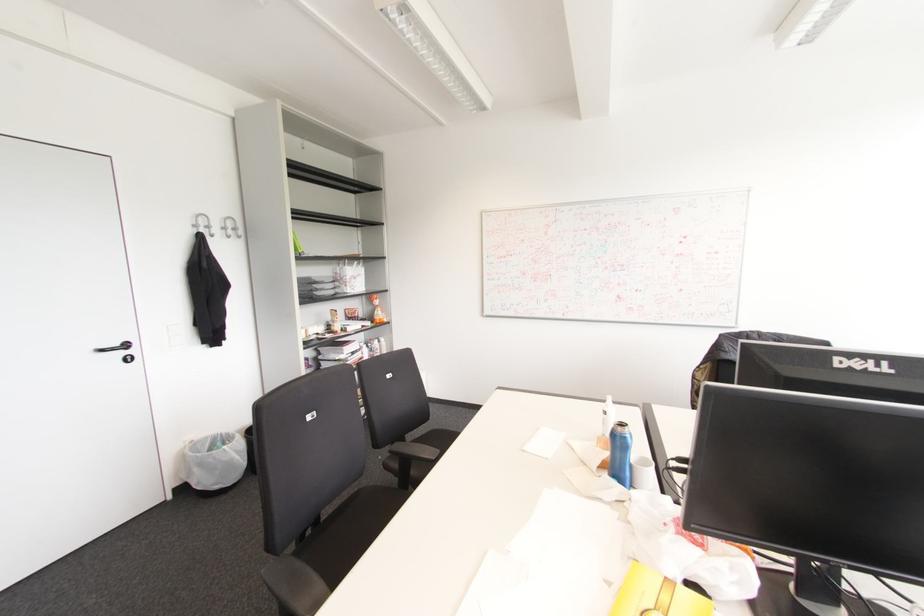
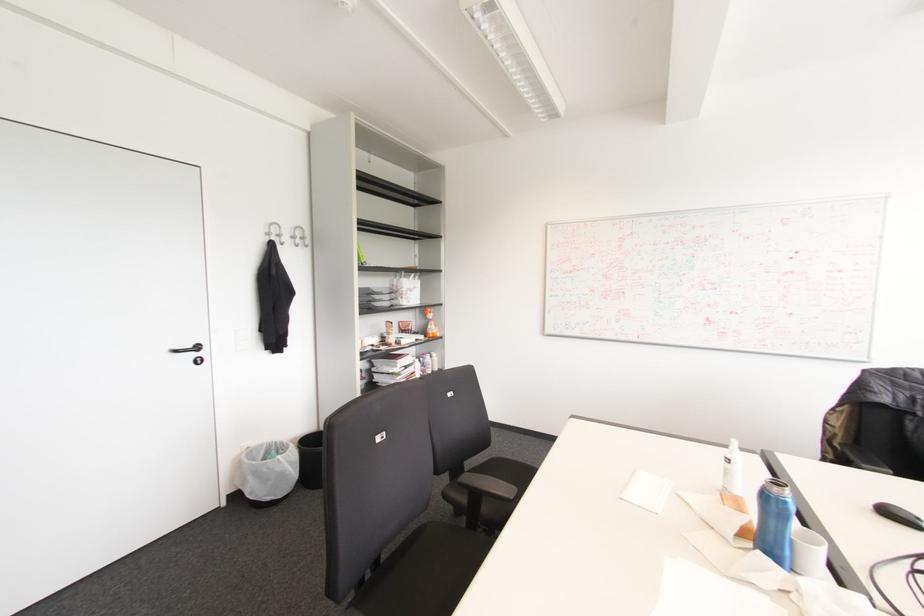
In the second image, find the point that corresponds to (x=438, y=451) in the first image.

(515, 488)